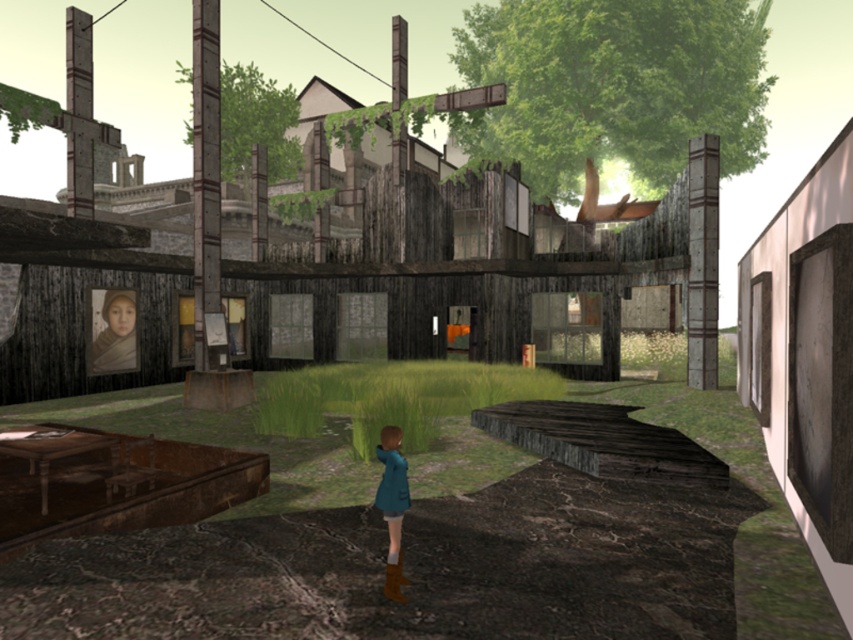
Based on the photo, you are an observer in the scene described. You notice two objects in the image, the teal fabric coat at center and the matte brown hair at upper left. Which object takes up more area in the image?

The matte brown hair at upper left takes up more area in the image than the teal fabric coat at center because the teal fabric coat at center occupies less space than matte brown hair at upper left.

You are a character in this scene and need to decide which clothing item to grab first. The teal fabric coat at center and the matte brown dress at upper left are both within reach. Which one is closer to your right hand if you are facing the building?

The teal fabric coat at center is positioned on the right side of matte brown dress at upper left, so it is closer to your right hand when facing the building.